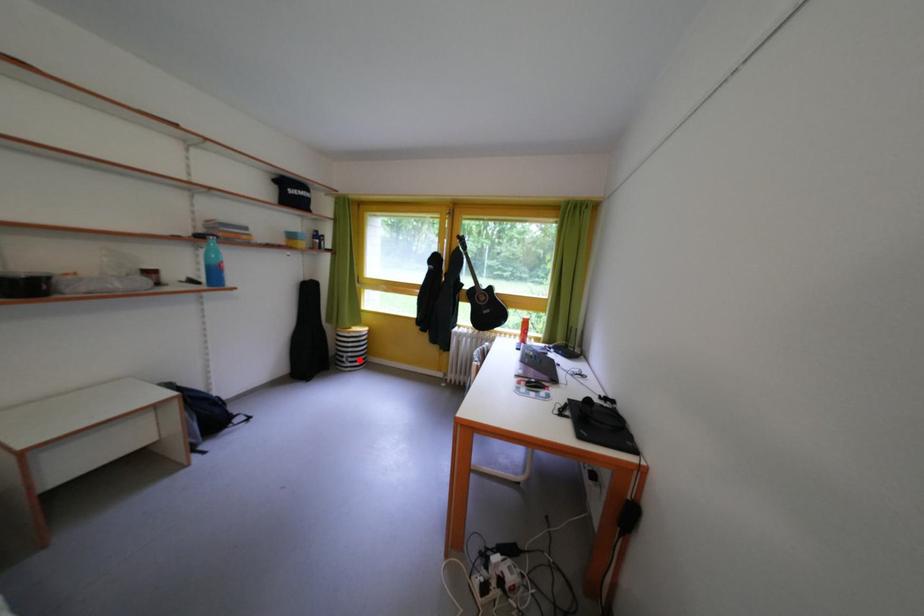
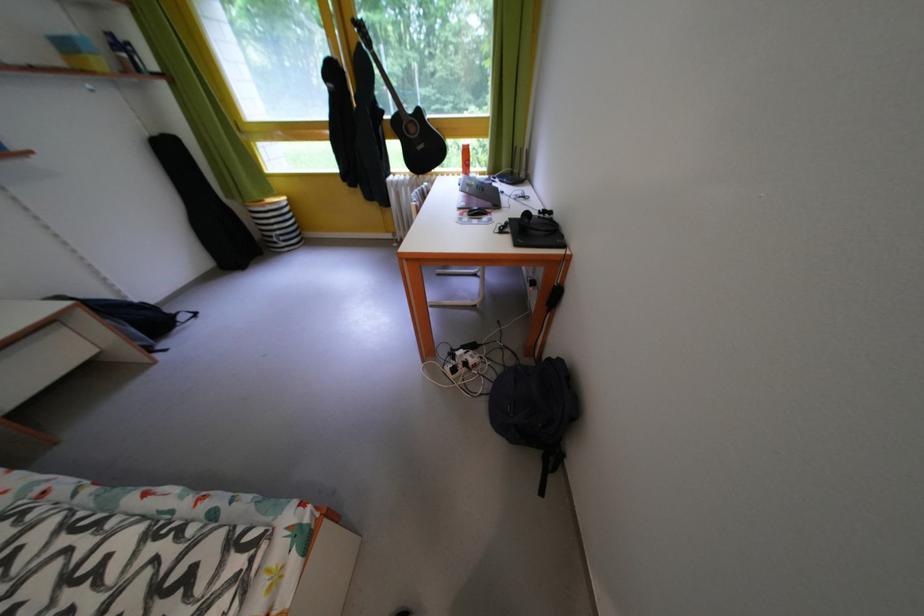
Find the pixel in the second image that matches the highlighted location in the first image.

(287, 238)